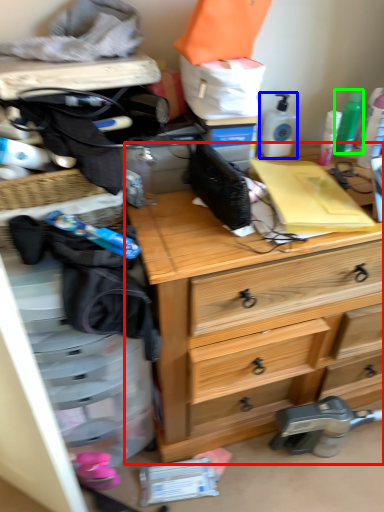
Question: Estimate the real-world distances between objects in this image. Which object is farther from chest of drawers (highlighted by a red box), toiletry (highlighted by a blue box) or toiletry (highlighted by a green box)?

Choices:
 (A) toiletry
 (B) toiletry

Answer: (B)